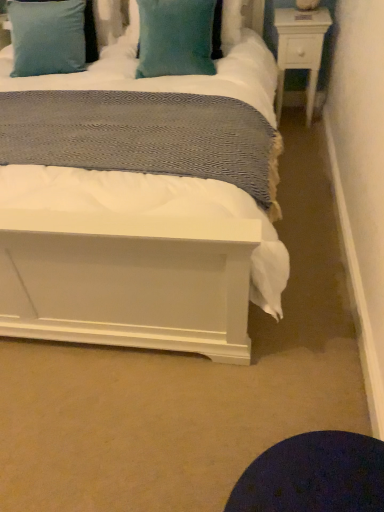
Question: Should I look upward or downward to see teal plush pillow at upper center, placed as the 2th pillow when sorted from left to right?

Choices:
 (A) up
 (B) down

Answer: (A)

Question: Is teal velvet pillow at upper center, which is the 2th pillow from right to left, bigger than teal plush pillow at upper center, placed as the 2th pillow when sorted from left to right?

Choices:
 (A) yes
 (B) no

Answer: (A)

Question: Is the surface of teal velvet pillow at upper center, which is the 2th pillow from right to left, in direct contact with teal plush pillow at upper center, which ranks as the first pillow in right-to-left order?

Choices:
 (A) no
 (B) yes

Answer: (A)

Question: Are teal velvet pillow at upper center, which is the 1th pillow from left to right, and teal plush pillow at upper center, which ranks as the first pillow in right-to-left order, located far from each other?

Choices:
 (A) yes
 (B) no

Answer: (B)

Question: Is teal velvet pillow at upper center, which is the 2th pillow from right to left, in front of teal plush pillow at upper center, which ranks as the first pillow in right-to-left order?

Choices:
 (A) no
 (B) yes

Answer: (A)

Question: Is teal velvet pillow at upper center, which is the 1th pillow from left to right, positioned behind teal plush pillow at upper center, which ranks as the first pillow in right-to-left order?

Choices:
 (A) yes
 (B) no

Answer: (A)

Question: Is teal velvet pillow at upper center, which is the 2th pillow from right to left, positioned with its back to teal plush pillow at upper center, which ranks as the first pillow in right-to-left order?

Choices:
 (A) yes
 (B) no

Answer: (B)

Question: Is teal velvet pillow at upper center, which is the 1th pillow from left to right, to the right of white wood nightstand at upper right from the viewer's perspective?

Choices:
 (A) no
 (B) yes

Answer: (A)

Question: Could you tell me if teal velvet pillow at upper center, which is the 1th pillow from left to right, is turned towards white wood nightstand at upper right?

Choices:
 (A) yes
 (B) no

Answer: (B)

Question: From the image's perspective, is teal velvet pillow at upper center, which is the 2th pillow from right to left, located beneath white wood nightstand at upper right?

Choices:
 (A) no
 (B) yes

Answer: (A)

Question: Can you confirm if teal velvet pillow at upper center, which is the 1th pillow from left to right, is smaller than white wood nightstand at upper right?

Choices:
 (A) no
 (B) yes

Answer: (A)

Question: Considering the relative sizes of teal velvet pillow at upper center, which is the 2th pillow from right to left, and white wood nightstand at upper right in the image provided, is teal velvet pillow at upper center, which is the 2th pillow from right to left, thinner than white wood nightstand at upper right?

Choices:
 (A) yes
 (B) no

Answer: (B)

Question: Would you say teal velvet pillow at upper center, which is the 1th pillow from left to right, contains white wood nightstand at upper right?

Choices:
 (A) no
 (B) yes

Answer: (A)

Question: Considering the relative positions of white wood nightstand at upper right and teal plush pillow at upper center, which ranks as the first pillow in right-to-left order, in the image provided, is white wood nightstand at upper right to the left of teal plush pillow at upper center, which ranks as the first pillow in right-to-left order, from the viewer's perspective?

Choices:
 (A) yes
 (B) no

Answer: (B)